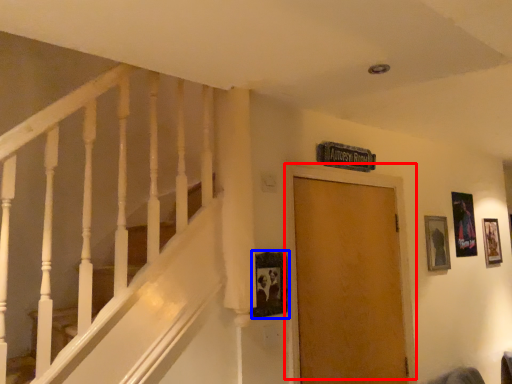
Question: Which object appears farthest to the camera in this image, door (highlighted by a red box) or picture frame (highlighted by a blue box)?

Choices:
 (A) door
 (B) picture frame

Answer: (A)